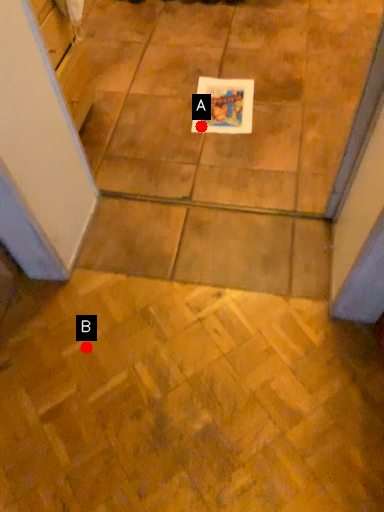
Question: Two points are circled on the image, labeled by A and B beside each circle. Which point is closer to the camera?

Choices:
 (A) A is closer
 (B) B is closer

Answer: (B)